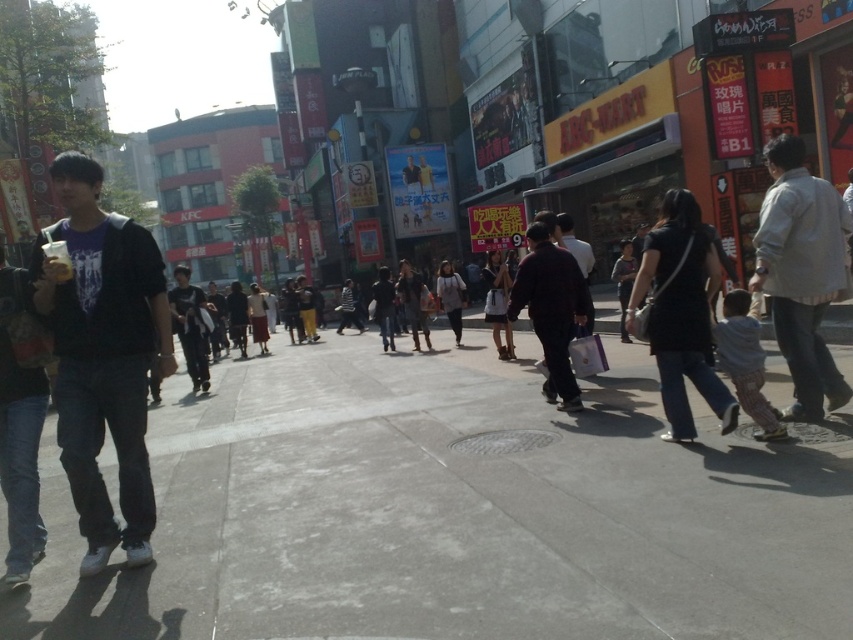
Question: Is black matte jacket at left smaller than dark gray hoodie at center?

Choices:
 (A) yes
 (B) no

Answer: (A)

Question: Is gray concrete pavement at center to the right of black matte jacket at left from the viewer's perspective?

Choices:
 (A) yes
 (B) no

Answer: (A)

Question: Which point appears closest to the camera in this image?

Choices:
 (A) (477, 360)
 (B) (785, 296)
 (C) (192, 353)
 (D) (550, 314)

Answer: (B)

Question: Which point is closer to the camera?

Choices:
 (A) (173, 403)
 (B) (544, 385)

Answer: (B)

Question: Does black matte jacket at left appear on the right side of light beige shirt at right?

Choices:
 (A) yes
 (B) no

Answer: (B)

Question: Which of the following is the closest to the observer?

Choices:
 (A) dark brown leather jacket at center
 (B) gray concrete pavement at center
 (C) light beige shirt at right

Answer: (B)